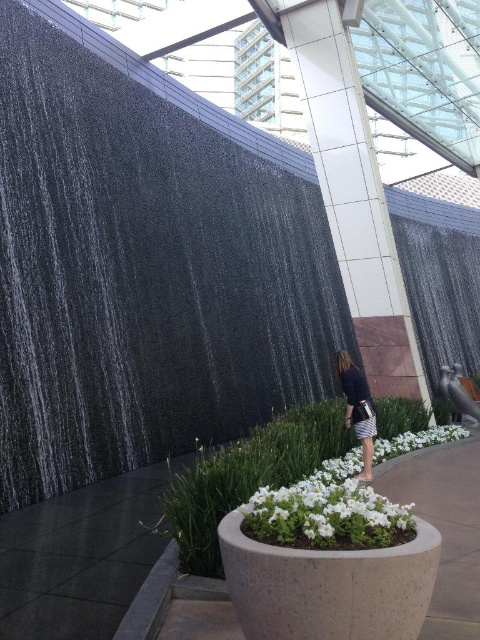
Question: Is black granite waterfall at left wider than white matte flower pot at center?

Choices:
 (A) no
 (B) yes

Answer: (B)

Question: Which point appears closest to the camera in this image?

Choices:
 (A) (355, 420)
 (B) (376, 408)

Answer: (A)

Question: Can you confirm if black granite waterfall at left is positioned to the right of dark blue fabric dress at center?

Choices:
 (A) yes
 (B) no

Answer: (B)

Question: Which object appears farthest from the camera in this image?

Choices:
 (A) white matte flower pot at center
 (B) white textured plant at center
 (C) dark blue fabric dress at center

Answer: (C)

Question: Which point appears farthest from the camera in this image?

Choices:
 (A) (351, 372)
 (B) (328, 468)
 (C) (10, 385)
 (D) (294, 406)

Answer: (D)

Question: Does black granite waterfall at left have a lesser width compared to dark blue fabric dress at center?

Choices:
 (A) yes
 (B) no

Answer: (B)